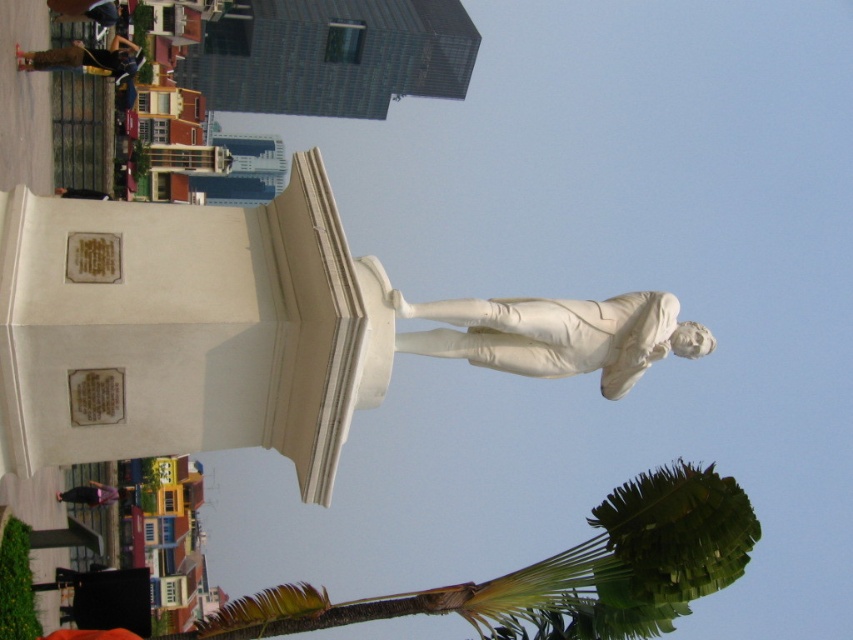
Question: Where is green leafy palm at lower right located in relation to white marble statue at center in the image?

Choices:
 (A) above
 (B) below

Answer: (B)

Question: Which point is closer to the camera taking this photo?

Choices:
 (A) (112, 4)
 (B) (643, 595)
 (C) (570, 323)

Answer: (C)

Question: Is green leafy palm at lower right bigger than matte black jacket at upper left?

Choices:
 (A) no
 (B) yes

Answer: (B)

Question: Which of the following is the farthest from the observer?

Choices:
 (A) (640, 336)
 (B) (113, 51)
 (C) (659, 467)

Answer: (B)

Question: Is white marble statue at center thinner than dark blue jeans at upper left?

Choices:
 (A) no
 (B) yes

Answer: (B)

Question: Which object is the closest to the green leafy palm at lower right?

Choices:
 (A) white marble statue at center
 (B) dark blue jeans at upper left

Answer: (A)